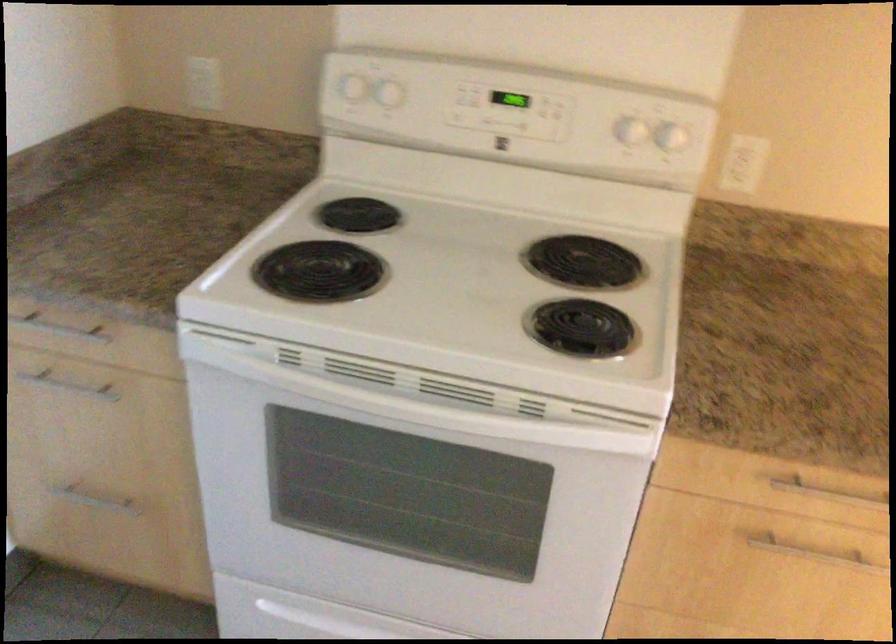
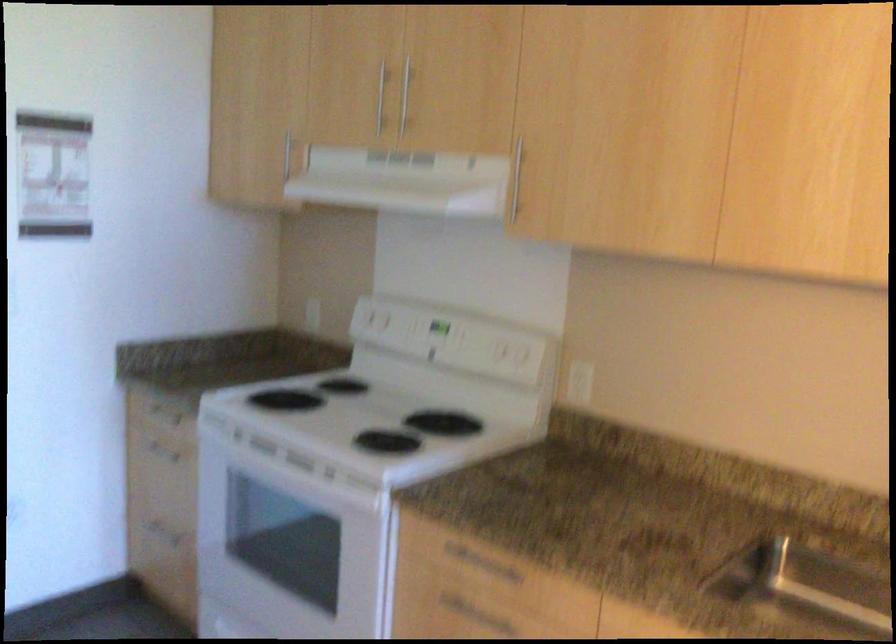
Where in the second image is the point corresponding to point 483,278 from the first image?

(367, 415)